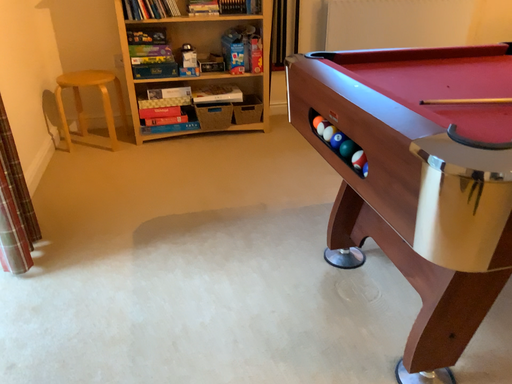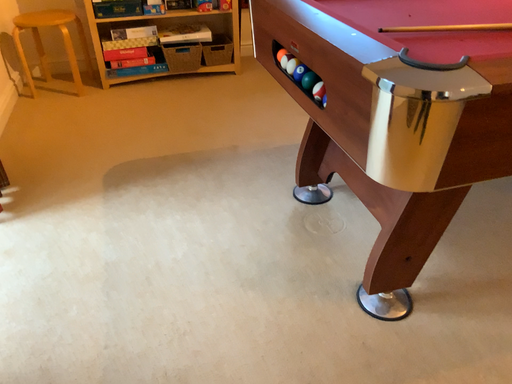
Question: Which way did the camera rotate in the video?

Choices:
 (A) rotated downward
 (B) rotated upward

Answer: (A)